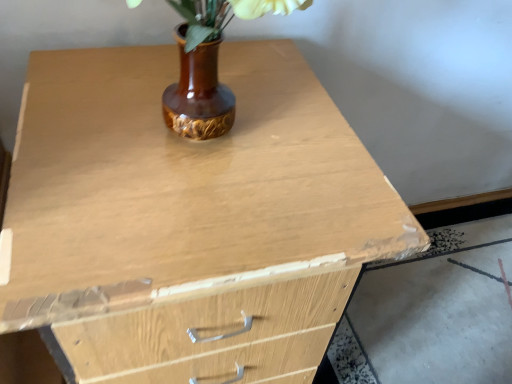
You are a GUI agent. You are given a task and a screenshot of the screen. Output one action in this format:
    pyautogui.click(x=<x>, y=<y>)
    Task: Click on the vacant space in front of browny-golden ceramic vase at center
    Image resolution: width=512 pixels, height=384 pixels.
    Given the screenshot: What is the action you would take?
    pyautogui.click(x=187, y=223)